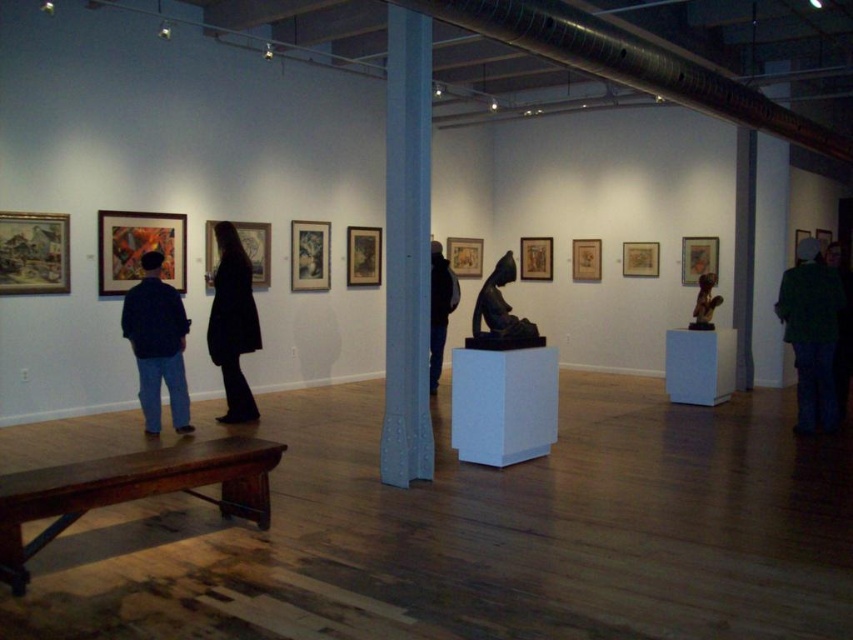
Does dark blue jeans at left come in front of black fabric at center?

Yes, dark blue jeans at left is in front of black fabric at center.

Identify the location of dark blue jeans at left. The width and height of the screenshot is (853, 640). (157, 344).

Does blue painted metal column at center lie in front of dark brown polished wood statue at center?

That is True.

Is point (395, 157) closer to camera compared to point (483, 282)?

Yes, it is in front of point (483, 282).

Describe the element at coordinates (407, 250) in the screenshot. I see `blue painted metal column at center` at that location.

The width and height of the screenshot is (853, 640). I want to click on blue painted metal column at center, so click(407, 250).

Who is taller, dark blue jeans at left or dark brown polished wood statue at center?

dark blue jeans at left is taller.

Between dark blue jeans at left and dark brown polished wood statue at center, which one appears on the left side from the viewer's perspective?

dark blue jeans at left

Does point (131, 300) lie behind point (477, 301)?

Yes, point (131, 300) is behind point (477, 301).

Find the location of a particular element. The height and width of the screenshot is (640, 853). dark blue jeans at left is located at coordinates (157, 344).